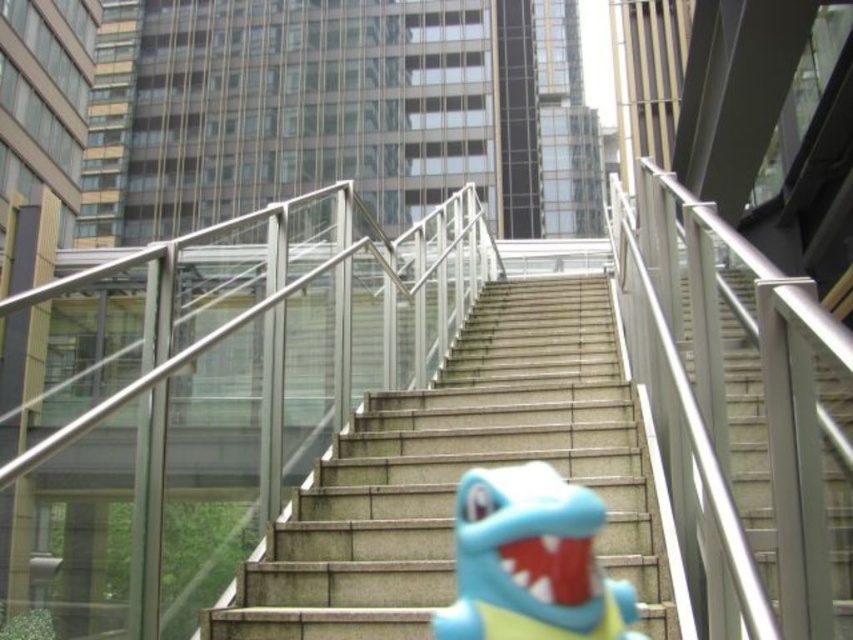
Question: Which object appears farthest from the camera in this image?

Choices:
 (A) metallic silver railing at center
 (B) concrete stairs at center
 (C) blue rubber toy at center
 (D) satin silver stairs at center

Answer: (B)

Question: Can you confirm if metallic silver railing at center is positioned to the left of blue rubber toy at center?

Choices:
 (A) yes
 (B) no

Answer: (A)

Question: Which of the following is the farthest from the observer?

Choices:
 (A) (320, 467)
 (B) (144, 554)

Answer: (A)

Question: Does metallic silver railing at center have a lesser width compared to satin silver stairs at center?

Choices:
 (A) yes
 (B) no

Answer: (A)

Question: Is concrete stairs at center thinner than blue rubber toy at center?

Choices:
 (A) no
 (B) yes

Answer: (A)

Question: Which point is closer to the camera?

Choices:
 (A) metallic silver railing at center
 (B) concrete stairs at center
 (C) blue rubber toy at center

Answer: (C)